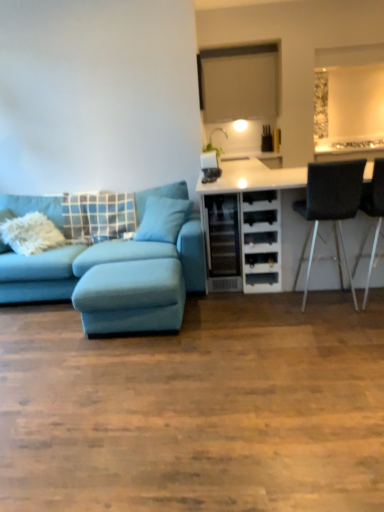
Where is `unoccupied area in front of light blue fabric footrest at lower left`? Image resolution: width=384 pixels, height=512 pixels. unoccupied area in front of light blue fabric footrest at lower left is located at coordinates (134, 362).